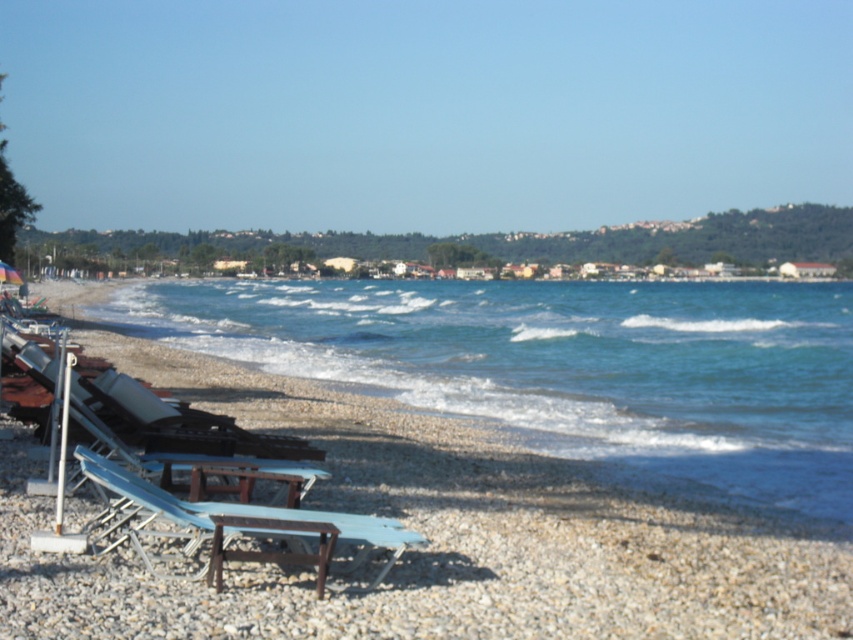
You are a beachgoer who wants to place a new beach towel on the sand. You see the blue water at lower left and the transparent plastic umbrella at lower left. Which object is closer to the water?

The blue water at lower left is positioned under the transparent plastic umbrella at lower left, meaning the umbrella is closer to the water.

You are standing on the beach and want to walk from point (473, 298) to point (320, 547). Which direction should you move in to get closer to your destination?

You should move away from the camera because point (473, 298) is further to the camera than point (320, 547).

You are standing at the origin point of the coordinate system placed at the bottom left corner of the image. You want to walk to the blue water at lower left. In which direction should you move relative to your current position?

Since the blue water at lower left is located at coordinate point (567, 364), you should move northeast to reach it from the origin point at the bottom left corner.